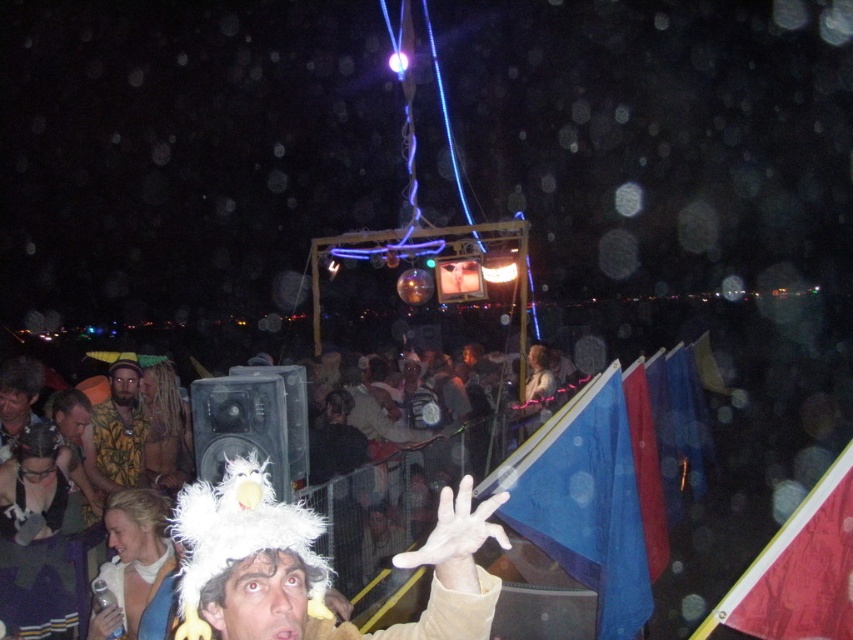
Question: Based on their relative distances, which object is nearer to the camouflage shirt at center?

Choices:
 (A) white fluffy hat at lower center
 (B) red fabric flag at lower right
 (C) blue fabric flag at upper right

Answer: (C)

Question: Which object is closer to the camera taking this photo?

Choices:
 (A) blue fabric flag at upper right
 (B) white fluffy hat at lower center
 (C) camouflage shirt at center
 (D) red fabric flag at lower right

Answer: (B)

Question: Is blue fabric flag at upper right positioned at the back of camouflage shirt at center?

Choices:
 (A) no
 (B) yes

Answer: (A)

Question: Can you confirm if red fabric flag at lower right is positioned below camouflage shirt at center?

Choices:
 (A) no
 (B) yes

Answer: (B)

Question: Can you confirm if white fluffy hat at lower center is smaller than camouflage shirt at center?

Choices:
 (A) no
 (B) yes

Answer: (A)

Question: Which object appears farthest from the camera in this image?

Choices:
 (A) red fabric flag at lower right
 (B) white fluffy hat at lower center
 (C) blue fabric flag at upper right
 (D) camouflage shirt at center

Answer: (D)